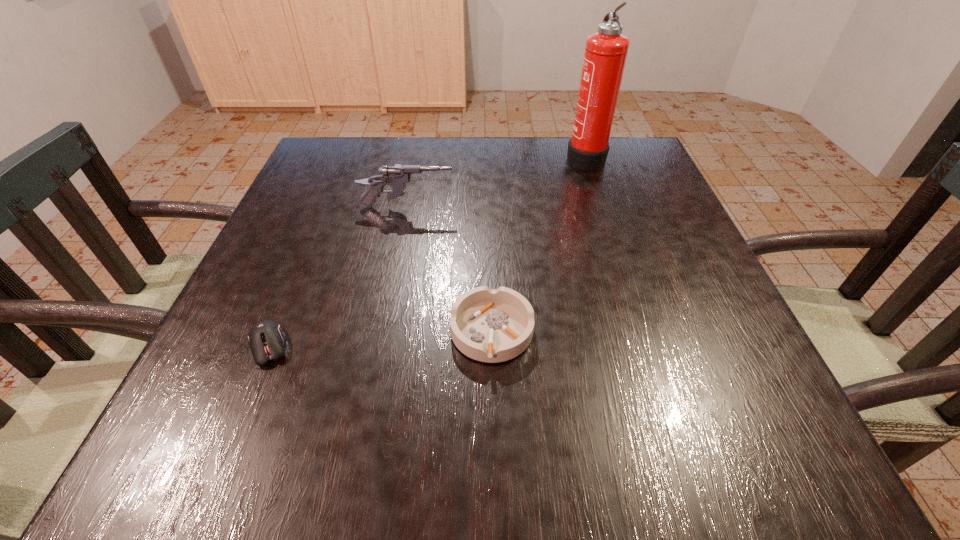
Locate an element on the screen. vacant space that's between the rightmost object and the ashtray is located at coordinates (539, 245).

Identify the location of free space between the shortest object and the farthest object. (427, 252).

This screenshot has width=960, height=540. In order to click on free space between the second object from left to right and the tallest object in this screenshot , I will do `click(496, 182)`.

You are a GUI agent. You are given a task and a screenshot of the screen. Output one action in this format:
    pyautogui.click(x=<x>, y=<y>)
    Task: Click on the object that is the second closest to the third nearest object
    The height and width of the screenshot is (540, 960).
    Given the screenshot: What is the action you would take?
    pyautogui.click(x=605, y=55)

The width and height of the screenshot is (960, 540). I want to click on the third closest object to the gun, so click(266, 339).

Locate an element on the screen. The height and width of the screenshot is (540, 960). vacant region that satisfies the following two spatial constraints: 1. at the barrel of the third shortest object; 2. on the left side of the third object from left to right is located at coordinates (383, 332).

In order to click on free location that satisfies the following two spatial constraints: 1. at the barrel of the third nearest object; 2. on the front side of the shortest object in this screenshot , I will do `click(380, 347)`.

Locate an element on the screen. The height and width of the screenshot is (540, 960). vacant area that satisfies the following two spatial constraints: 1. at the barrel of the third shortest object; 2. on the back side of the ashtray is located at coordinates (383, 332).

Find the location of `free space in the image that satisfies the following two spatial constraints: 1. on the back side of the ashtray; 2. at the barrel of the second object from left to right`. free space in the image that satisfies the following two spatial constraints: 1. on the back side of the ashtray; 2. at the barrel of the second object from left to right is located at coordinates (489, 207).

What are the coordinates of `free space that satisfies the following two spatial constraints: 1. on the front-facing side of the tallest object; 2. on the front side of the leftmost object` in the screenshot? It's located at (646, 347).